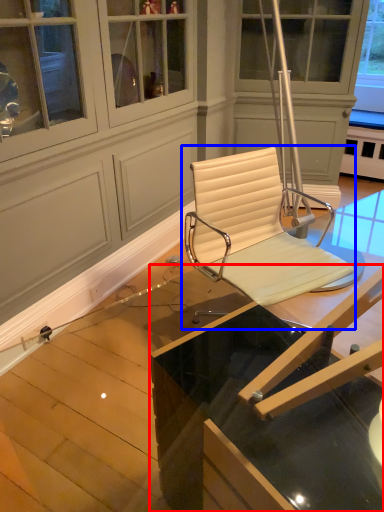
Question: Which point is closer to the camera, table (highlighted by a red box) or chair (highlighted by a blue box)?

Choices:
 (A) table
 (B) chair

Answer: (A)